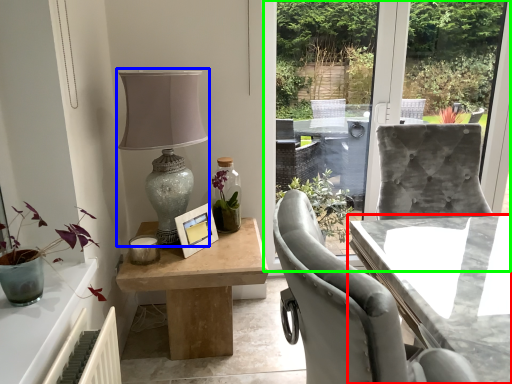
Question: Which is nearer to the table (highlighted by a red box)? table lamp (highlighted by a blue box) or window screen (highlighted by a green box).

Choices:
 (A) table lamp
 (B) window screen

Answer: (A)